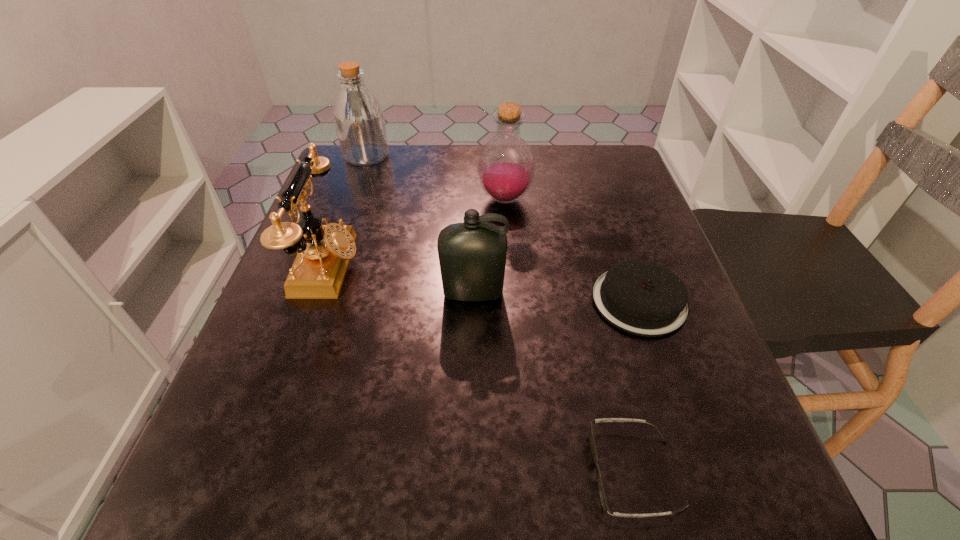
What are the coordinates of `the farthest bottle` in the screenshot? It's located at (358, 116).

Locate an element on the screen. the leftmost bottle is located at coordinates (358, 116).

Identify the location of the second farthest bottle. The image size is (960, 540). (506, 168).

This screenshot has width=960, height=540. In order to click on telephone in this screenshot , I will do `click(323, 252)`.

Locate an element on the screen. the shortest bottle is located at coordinates (472, 255).

Identify the location of the second shortest object. Image resolution: width=960 pixels, height=540 pixels. [x=640, y=297].

Identify the location of sunglasses. The height and width of the screenshot is (540, 960). (604, 504).

The image size is (960, 540). I want to click on the nearest object, so click(x=604, y=504).

Where is `vacant space situated 0.080m on the right of the farthest object`? vacant space situated 0.080m on the right of the farthest object is located at coordinates (420, 156).

Where is `vacant space located 0.160m on the back of the second farthest bottle`? vacant space located 0.160m on the back of the second farthest bottle is located at coordinates (502, 151).